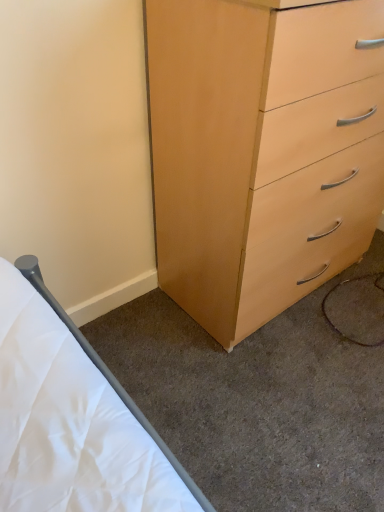
The image size is (384, 512). What do you see at coordinates (262, 152) in the screenshot?
I see `light wood chest of drawers at right` at bounding box center [262, 152].

What is the approximate height of light wood chest of drawers at right?

light wood chest of drawers at right is 1.03 meters tall.

Identify the location of light wood chest of drawers at right. Image resolution: width=384 pixels, height=512 pixels. (262, 152).

This screenshot has width=384, height=512. I want to click on light wood chest of drawers at right, so click(262, 152).